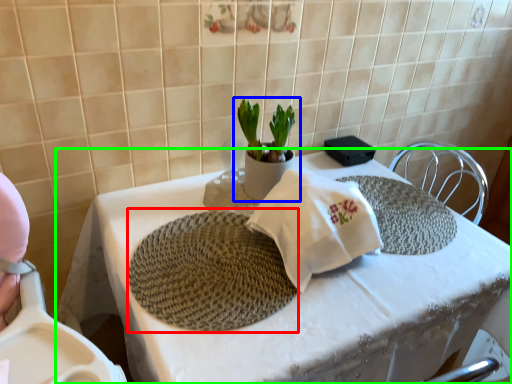
Question: Based on their relative distances, which object is farther from mat (highlighted by a red box)? Choose from houseplant (highlighted by a blue box) and table (highlighted by a green box).

Choices:
 (A) houseplant
 (B) table

Answer: (A)